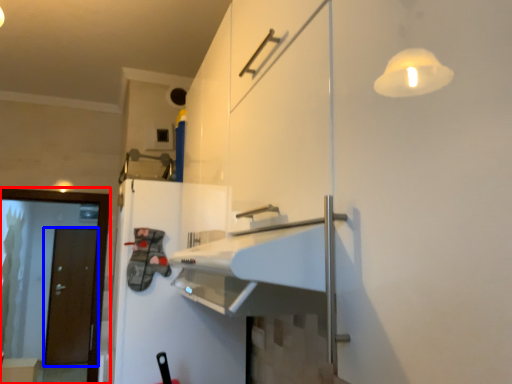
Question: Which of the following is the closest to the observer, screen door (highlighted by a red box) or door (highlighted by a blue box)?

Choices:
 (A) screen door
 (B) door

Answer: (A)